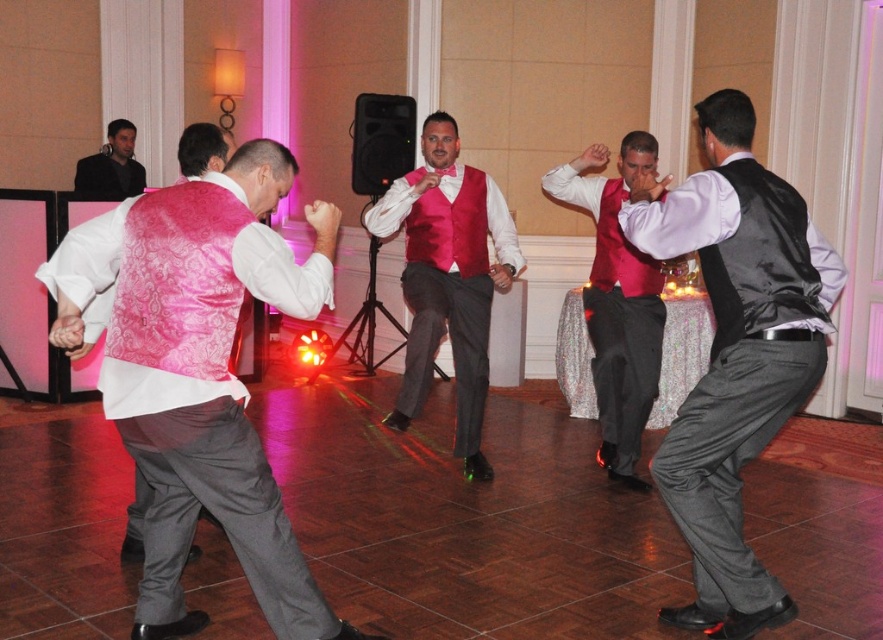
Image resolution: width=883 pixels, height=640 pixels. In order to click on shiny red vest at center in this screenshot , I will do `click(448, 276)`.

Is shiny red vest at center positioned before black fabric jacket at upper left?

That is True.

Which is in front, point (461, 333) or point (141, 166)?

Point (461, 333) is more forward.

Where is `shiny red vest at center`? Image resolution: width=883 pixels, height=640 pixels. shiny red vest at center is located at coordinates (448, 276).

Is matte red vest at center closer to camera compared to black fabric jacket at upper left?

Yes, matte red vest at center is closer to the viewer.

Between point (629, 184) and point (106, 156), which one is positioned behind?

The point (106, 156) is more distant.

I want to click on matte red vest at center, so click(617, 301).

Between point (774, 227) and point (117, 132), which one is positioned in front?

Point (774, 227) is in front.

Can you confirm if satin black vest at center is bigger than black fabric jacket at upper left?

Yes.

Find the location of `satin black vest at center`. satin black vest at center is located at coordinates (736, 353).